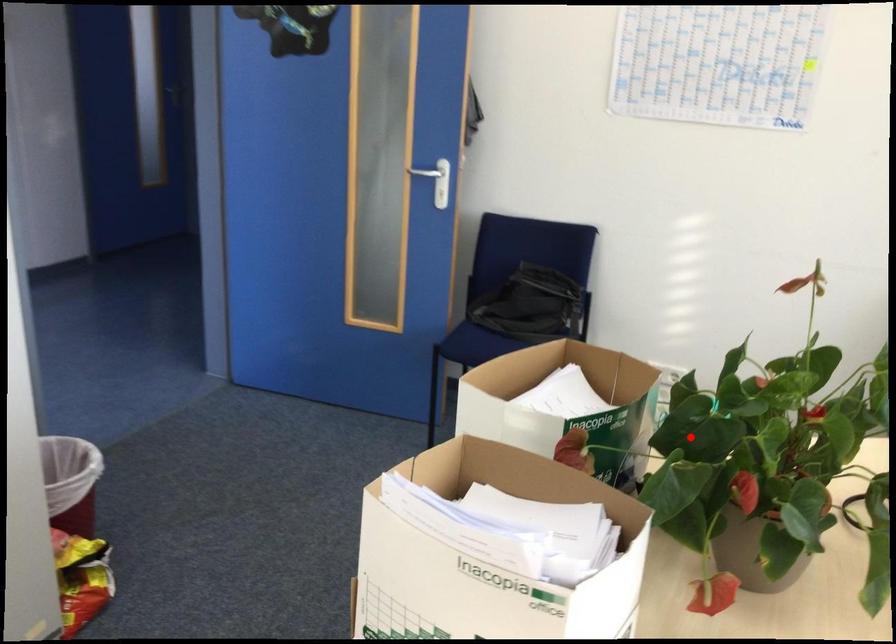
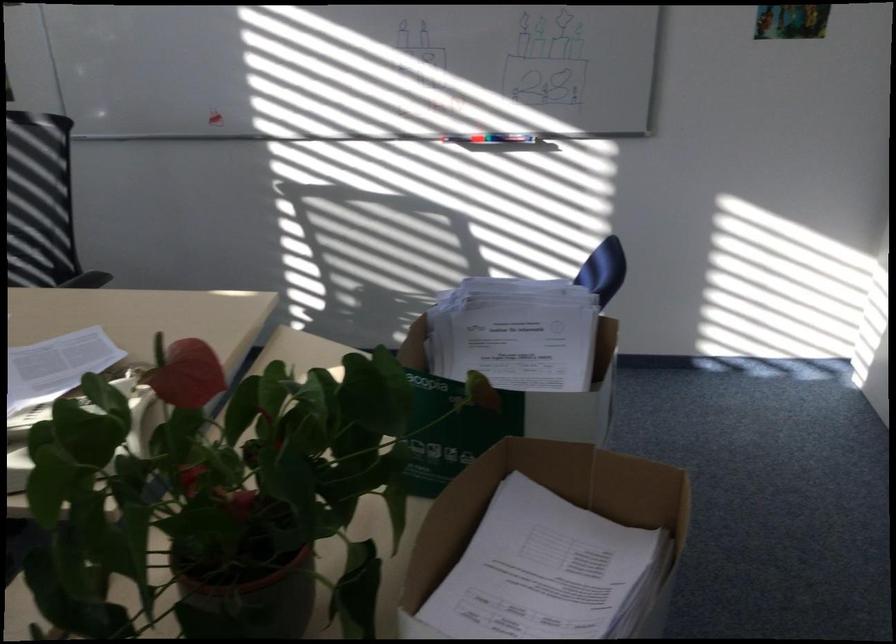
Question: I am providing you with two images of the same scene from different viewpoints. A red point is shown in image1. For the corresponding object point in image2, is it positioned nearer or farther from the camera?

Choices:
 (A) Nearer
 (B) Farther

Answer: (A)